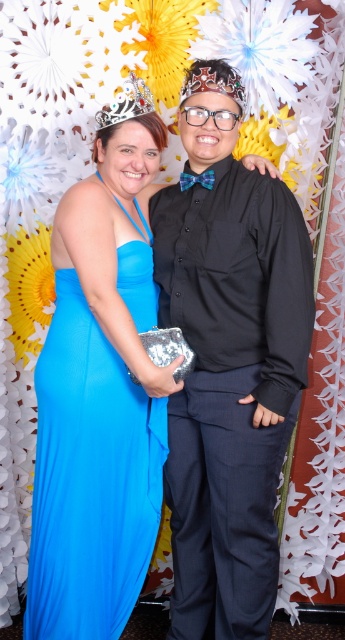
Question: Estimate the real-world distances between objects in this image. Which object is farther from the matte blue dress at left?

Choices:
 (A) gold metallic crown at upper center
 (B) matte black shirt at center

Answer: (A)

Question: Is matte blue dress at left below silver metallic crown at upper center?

Choices:
 (A) yes
 (B) no

Answer: (A)

Question: Considering the real-world distances, which object is farthest from the matte blue dress at left?

Choices:
 (A) gold metallic crown at upper center
 (B) silver metallic crown at upper center

Answer: (A)

Question: Based on their relative distances, which object is nearer to the matte blue dress at left?

Choices:
 (A) matte black shirt at center
 (B) silver metallic crown at upper center
 (C) gold metallic crown at upper center

Answer: (A)

Question: Does matte black shirt at center have a larger size compared to silver metallic crown at upper center?

Choices:
 (A) yes
 (B) no

Answer: (A)

Question: Can you confirm if silver metallic crown at upper center is positioned to the right of gold metallic crown at upper center?

Choices:
 (A) no
 (B) yes

Answer: (A)